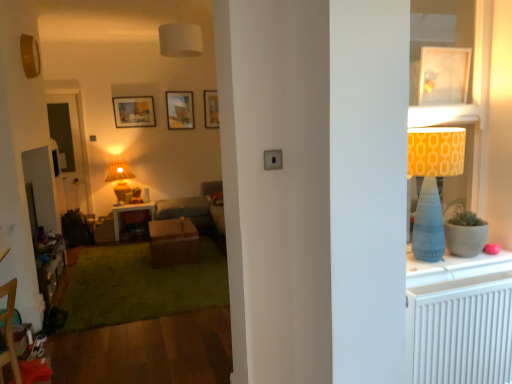
Question: Looking at the image, does matte blue cone-shaped lampshade at right, the first lamp in the bottom-to-top sequence, seem bigger or smaller compared to wooden picture frame at upper center, which is counted as the 2th picture frame, starting from the right?

Choices:
 (A) small
 (B) big

Answer: (B)

Question: Is matte blue cone-shaped lampshade at right, which is the first lamp in right-to-left order, taller or shorter than wooden picture frame at upper center, which is counted as the third picture frame, starting from the left?

Choices:
 (A) short
 (B) tall

Answer: (B)

Question: Which of these objects is positioned farthest from the white textured radiator at right?

Choices:
 (A) brown matte table at center
 (B) white fabric lampshade at upper center, which appears as the 2th lamp when viewed from the front
 (C) white glossy picture frame at upper right, the 4th picture frame from the left
 (D) matte wooden desk at center
 (E) matte blue cone-shaped lampshade at right, positioned as the first lamp in front-to-back order

Answer: (D)

Question: Based on their relative distances, which object is farther from the transparent glass door at left?

Choices:
 (A) matte wooden picture frame at upper center, which is the 3th picture frame from back to front
 (B) matte yellow lampshade at center, placed as the third lamp when sorted from right to left
 (C) white glossy picture frame at upper right, the 1th picture frame in the front-to-back sequence
 (D) matte wooden desk at center
 (E) wooden picture frame at upper center, the second picture frame from the back

Answer: (C)